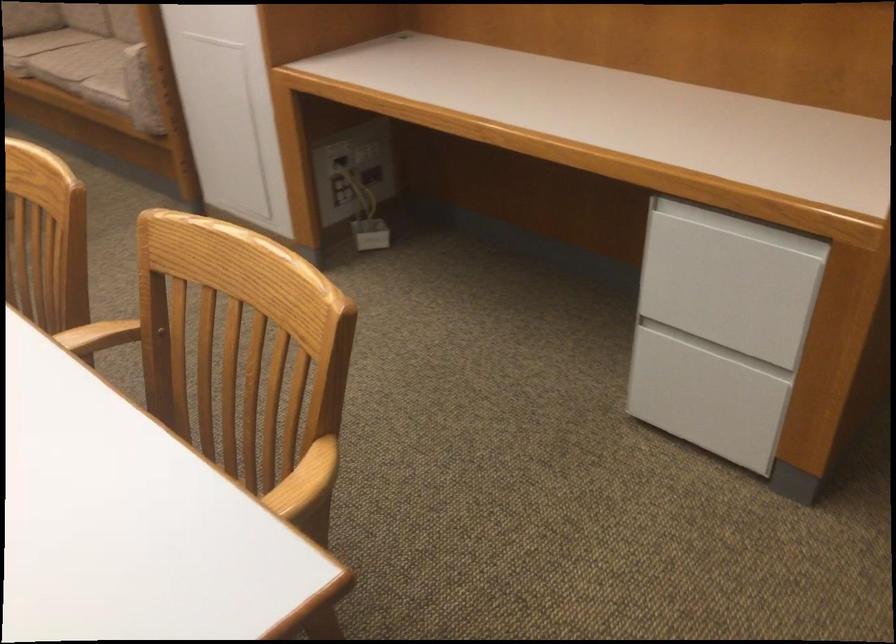
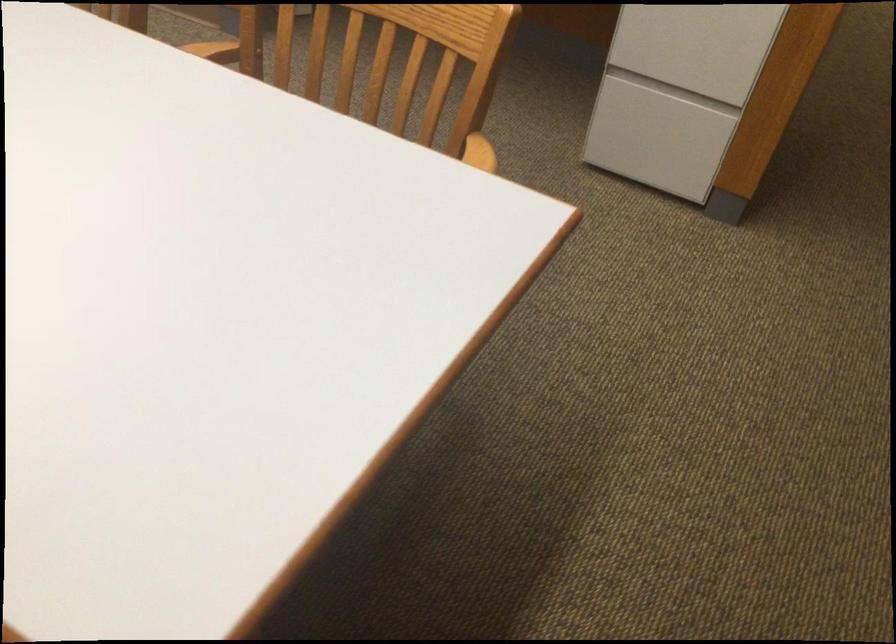
Find the pixel in the second image that matches point 762,281 in the first image.

(735, 26)